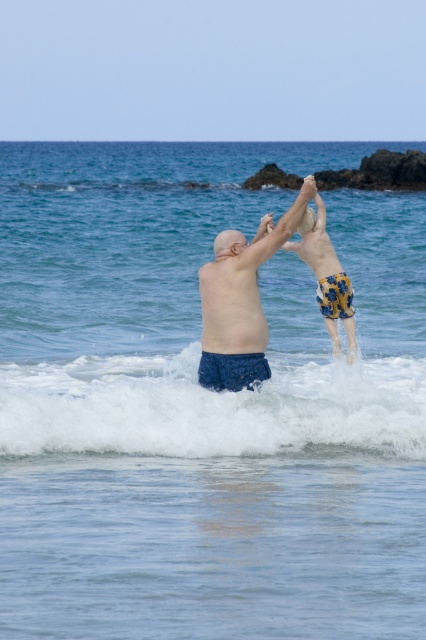
Question: Which object is positioned farthest from the white foamy wave at center?

Choices:
 (A) blue fabric shorts at center
 (B) blue textured shorts at center

Answer: (B)

Question: Can you confirm if white foamy wave at center is positioned to the right of blue textured shorts at center?

Choices:
 (A) no
 (B) yes

Answer: (A)

Question: Based on their relative distances, which object is farther from the blue textured shorts at center?

Choices:
 (A) blue fabric shorts at center
 (B) white foamy wave at center

Answer: (B)

Question: Observing the image, what is the correct spatial positioning of white foamy wave at center in reference to blue textured shorts at center?

Choices:
 (A) below
 (B) above

Answer: (A)

Question: Among these points, which one is nearest to the camera?

Choices:
 (A) [256, 307]
 (B) [207, 426]
 (C) [294, 250]

Answer: (B)

Question: Can you confirm if blue fabric shorts at center is positioned to the left of blue textured shorts at center?

Choices:
 (A) yes
 (B) no

Answer: (A)